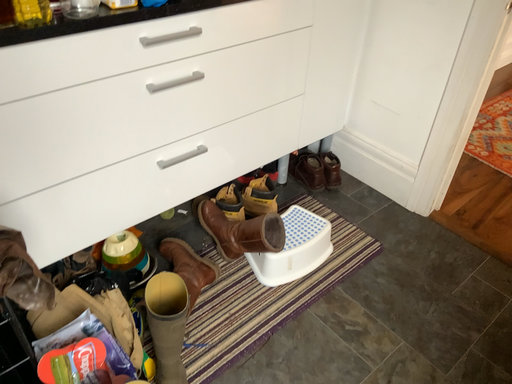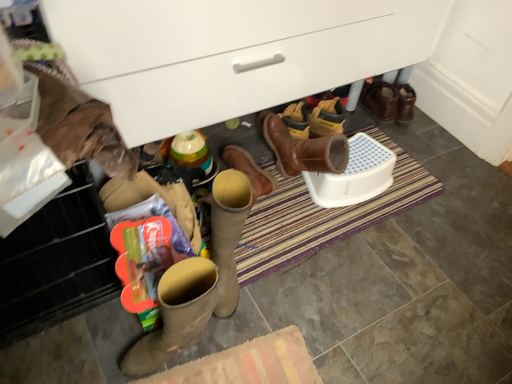
Question: Which way did the camera rotate in the video?

Choices:
 (A) rotated upward
 (B) rotated downward

Answer: (B)